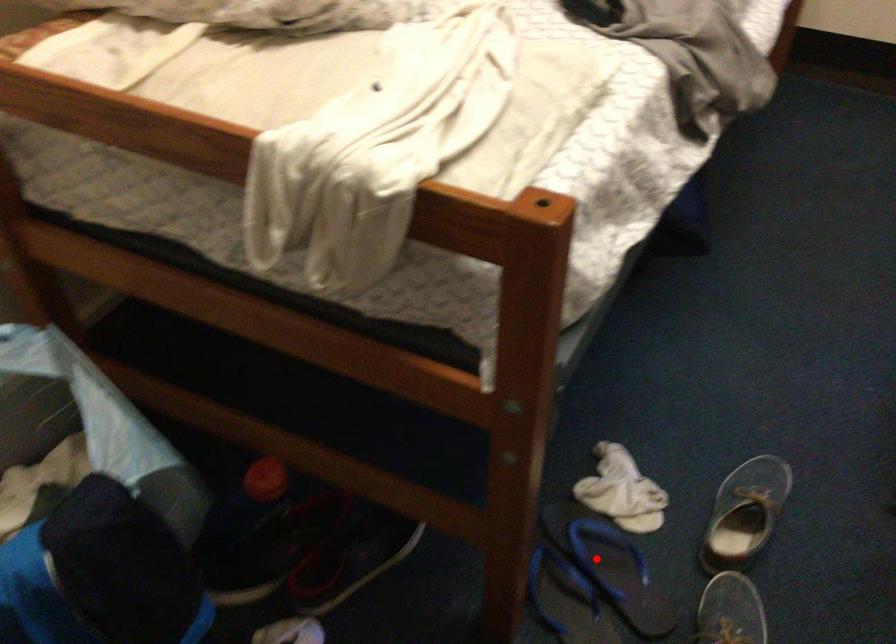
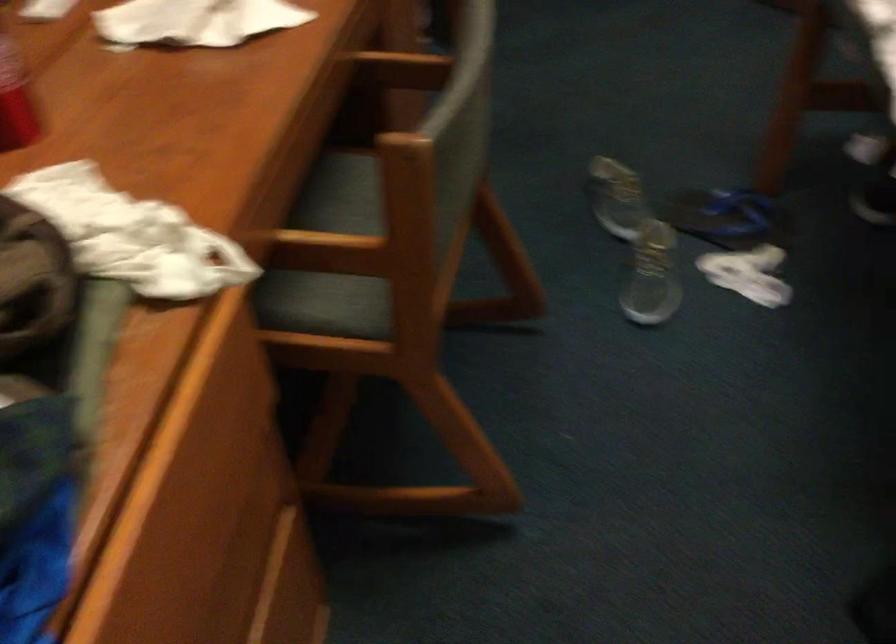
Question: I am providing you with two images of the same scene from different viewpoints. In image1, a red point is highlighted. Considering the same 3D point in image2, which of the following is correct?

Choices:
 (A) It is closer
 (B) It is farther

Answer: (B)